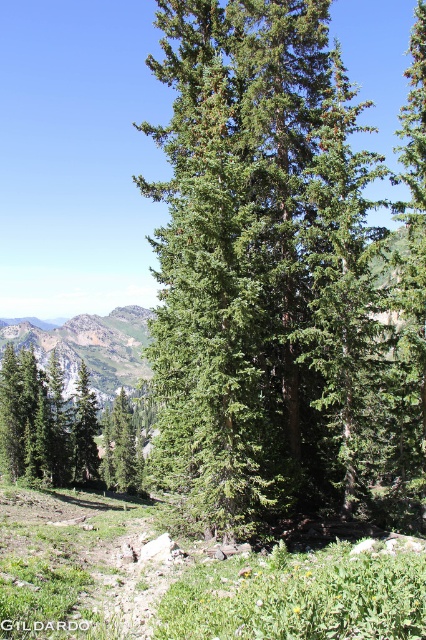
You are a hiker planning to take a photo of both the green matte tree at lower left and the green leafy mountain at center. Since you want both to be in focus, which object should you position closer to your camera to ensure clarity?

To ensure both the green matte tree at lower left and the green leafy mountain at center are in focus, you should position yourself closer to the green matte tree at lower left since it is shorter than the green leafy mountain at center.

You are standing at the base of the mountain looking towards the trees. There are two points marked in the image, point A at coordinates point (218, 38) and point B at coordinates point (63, 365). Which point is closer to you?

Point A at coordinates point (218, 38) is closer to you because it is in front of point B at coordinates point (63, 365).